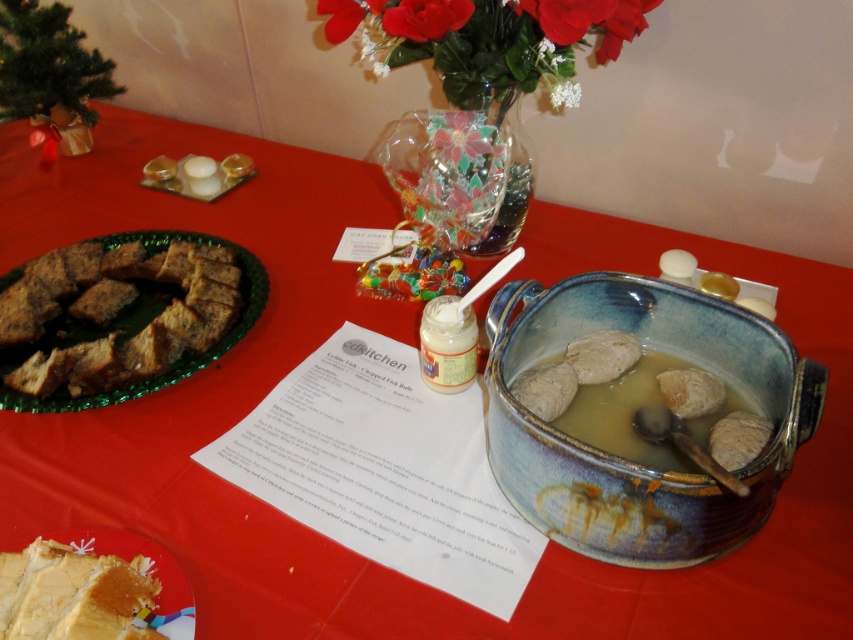
Between point (120, 582) and point (577, 104), which one is positioned behind?

Positioned behind is point (577, 104).

In the scene shown: Is yellow cake at center to the left of white matte flower at upper center from the viewer's perspective?

Yes, yellow cake at center is to the left of white matte flower at upper center.

This screenshot has height=640, width=853. What do you see at coordinates (73, 595) in the screenshot?
I see `yellow cake at center` at bounding box center [73, 595].

Locate an element on the screen. yellow cake at center is located at coordinates (73, 595).

Is point (329, 29) positioned before point (584, 428)?

No.

Does red silk flowers at upper center have a lesser width compared to blue glazed pot at center?

Incorrect, red silk flowers at upper center's width is not less than blue glazed pot at center's.

Measure the distance between red silk flowers at upper center and camera.

red silk flowers at upper center and camera are 25.39 inches apart.

You are a GUI agent. You are given a task and a screenshot of the screen. Output one action in this format:
    pyautogui.click(x=<x>, y=<y>)
    Task: Click on the red silk flowers at upper center
    Image resolution: width=853 pixels, height=640 pixels.
    Given the screenshot: What is the action you would take?
    pyautogui.click(x=486, y=36)

Which of these two, blue glazed pot at center or white matte flower at upper center, stands taller?

Standing taller between the two is blue glazed pot at center.

How far apart are blue glazed pot at center and white matte flower at upper center?

34.56 centimeters

Image resolution: width=853 pixels, height=640 pixels. In order to click on blue glazed pot at center in this screenshot , I will do `click(647, 408)`.

Find the location of a particular element. This screenshot has height=640, width=853. blue glazed pot at center is located at coordinates (647, 408).